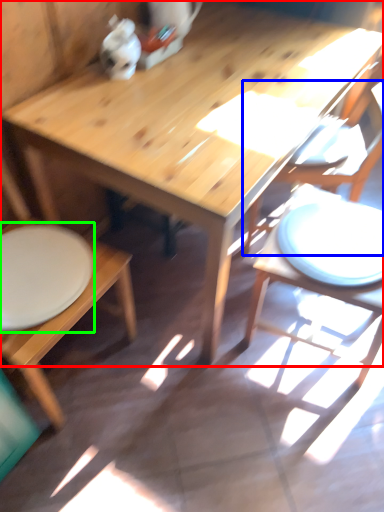
Question: Considering the real-world distances, which object is farthest from table (highlighted by a red box)? chair (highlighted by a blue box) or plate (highlighted by a green box)?

Choices:
 (A) chair
 (B) plate

Answer: (A)